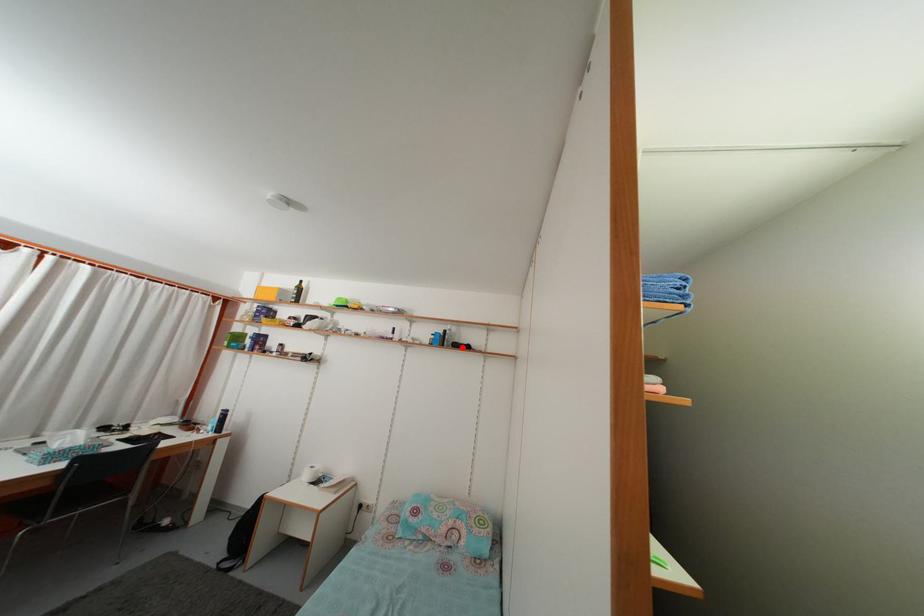
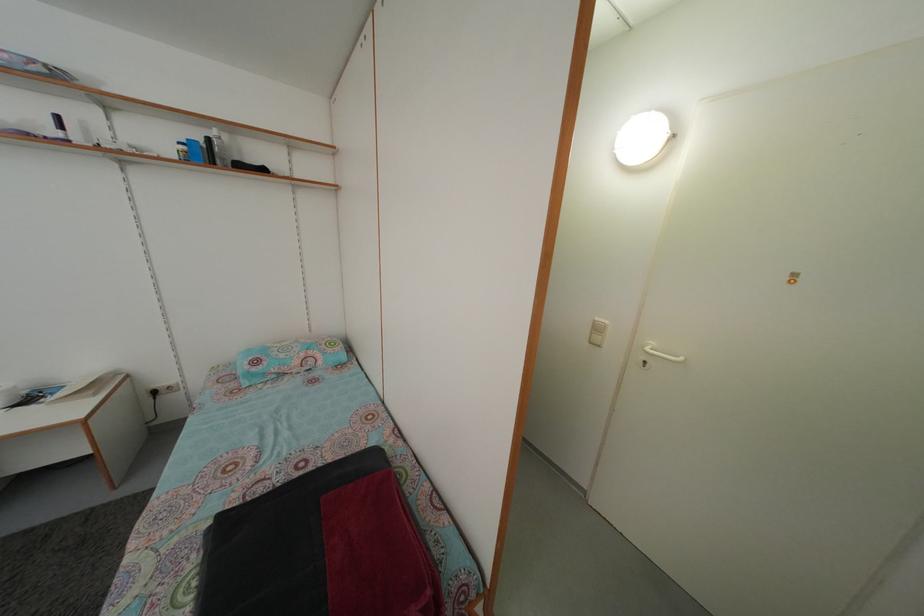
The point at the highlighted location is marked in the first image. Where is the corresponding point in the second image?

(242, 166)